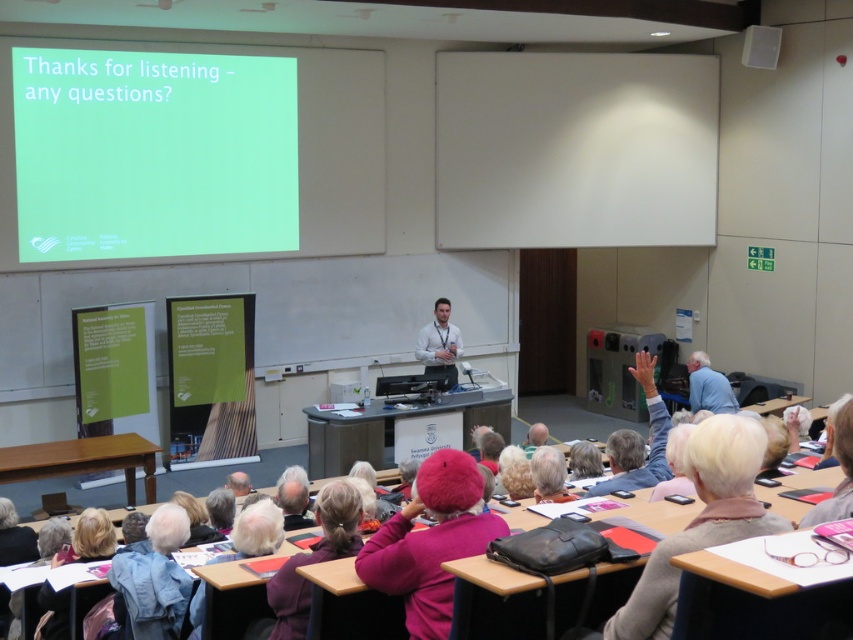
You are standing at the point marked as point [136,609] in the lecture hall. You want to take a photo of the presenter behind the desk. Is the camera at your current position able to capture the presenter in the frame?

The distance between point [136,609] and the camera is 12.98 feet. Since the camera is positioned at your current location, it can capture the presenter as they are within the frame range.

You are an attendee at the lecture hall. You want to find the denim jacket at lower left. Where is the point with coordinates point (154, 579) located?

The point (154, 579) is located on the denim jacket at lower left.